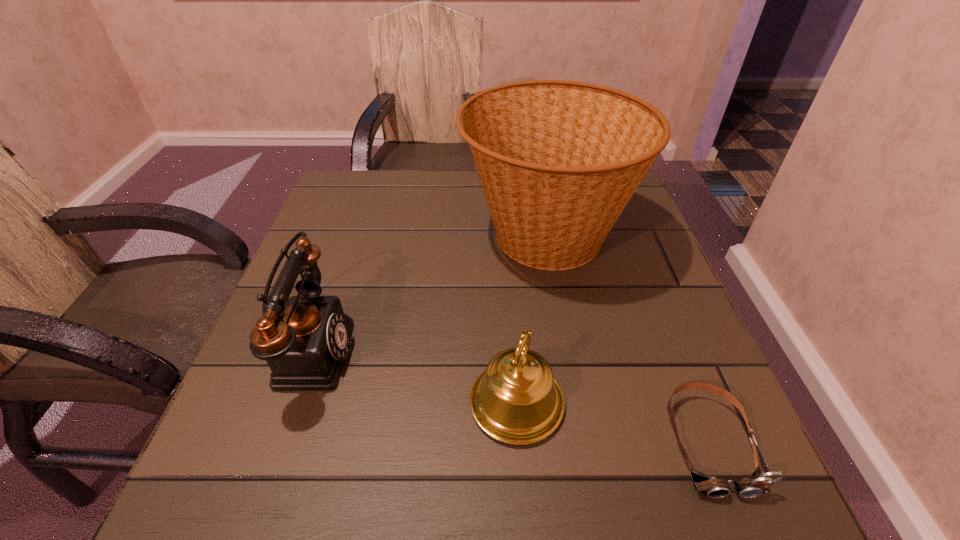
The width and height of the screenshot is (960, 540). In order to click on the tallest object in this screenshot , I will do `click(558, 160)`.

In order to click on basket in this screenshot , I will do `click(558, 160)`.

Where is `the leftmost object`? This screenshot has height=540, width=960. the leftmost object is located at coordinates (305, 347).

Locate an element on the screen. the second shortest object is located at coordinates (516, 400).

Where is `the shortest object`? The height and width of the screenshot is (540, 960). the shortest object is located at coordinates (758, 483).

In order to click on vacant space situated 0.260m on the front of the basket in this screenshot , I will do `click(578, 414)`.

At what (x,y) coordinates should I click in order to perform the action: click on free space located on the front of the telephone at the rotary dial. Please return your answer as a coordinate pair (x, y). Image resolution: width=960 pixels, height=540 pixels. Looking at the image, I should click on (452, 350).

What are the coordinates of `free space located 0.240m on the back of the bell` in the screenshot? It's located at (508, 273).

The image size is (960, 540). In order to click on object that is at the far edge in this screenshot , I will do `click(558, 160)`.

You are a GUI agent. You are given a task and a screenshot of the screen. Output one action in this format:
    pyautogui.click(x=<x>, y=<y>)
    Task: Click on the object present at the near edge
    This screenshot has width=960, height=540.
    Given the screenshot: What is the action you would take?
    pyautogui.click(x=758, y=483)